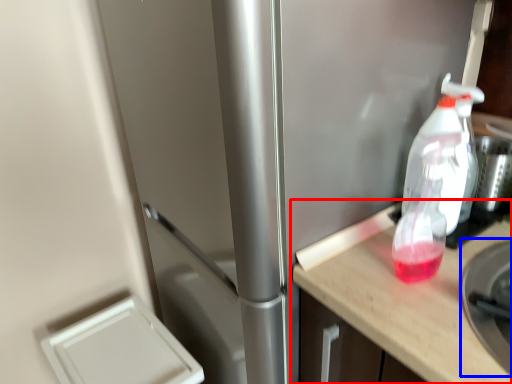
Question: Which object appears farthest to the camera in this image, countertop (highlighted by a red box) or appliance (highlighted by a blue box)?

Choices:
 (A) countertop
 (B) appliance

Answer: (A)